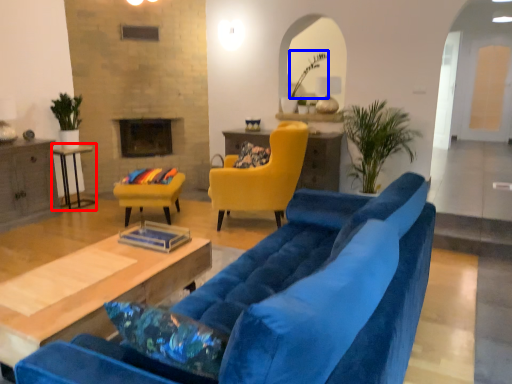
Question: Among these objects, which one is nearest to the camera, table (highlighted by a red box) or plant (highlighted by a blue box)?

Choices:
 (A) table
 (B) plant

Answer: (A)